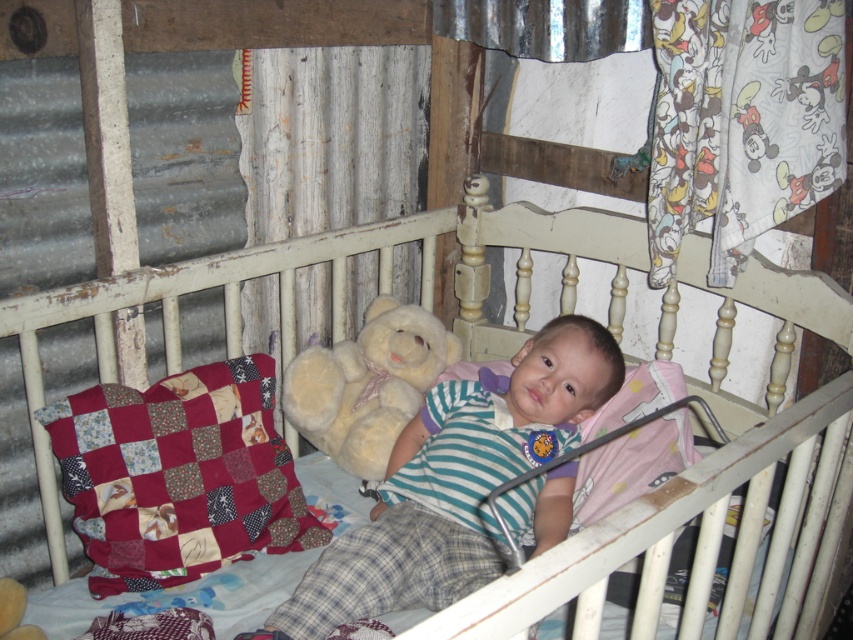
You are a parent trying to place a new decorative pillow on the shelf above the white wooden crib at center. The shelf can only hold items that are shorter than the crib. Can the patchwork fabric pillow at left be placed there?

The white wooden crib at center is taller than the patchwork fabric pillow at left, so the pillow is shorter than the crib. Therefore, the patchwork fabric pillow at left can be placed on the shelf above the white wooden crib at center since it meets the height requirement.

You are standing in the room and want to place a new mobile above the white wooden crib at center. According to the image, where should you position the mobile in terms of horizontal and vertical coordinates?

The white wooden crib at center is located at coordinates 0.750 on the horizontal axis and 0.834 on the vertical axis, so the mobile should be placed directly above these coordinates to center it above the crib.